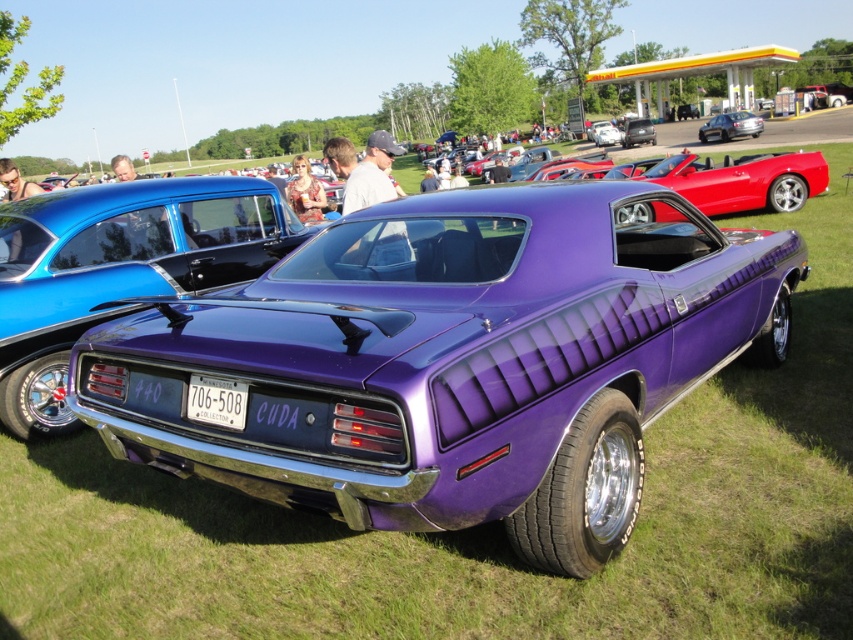
Question: Is metallic purple muscle car at center wider than white plastic license plate at center?

Choices:
 (A) yes
 (B) no

Answer: (A)

Question: Which object appears closest to the camera in this image?

Choices:
 (A) white plastic license plate at center
 (B) metallic silver sedan at center
 (C) metallic purple muscle car at center

Answer: (C)

Question: Where is metallic purple muscle car at center located in relation to metallic silver sedan at center in the image?

Choices:
 (A) left
 (B) right

Answer: (A)

Question: Which point is farther to the camera?

Choices:
 (A) metallic silver sedan at center
 (B) metallic blue sedan at center
 (C) metallic purple muscle car at center
 (D) white plastic license plate at center

Answer: (A)

Question: Does metallic purple muscle car at center lie behind metallic blue sedan at center?

Choices:
 (A) no
 (B) yes

Answer: (A)

Question: Which of the following is the farthest from the observer?

Choices:
 (A) metallic purple muscle car at center
 (B) white plastic license plate at center
 (C) metallic blue sedan at center
 (D) metallic silver sedan at center

Answer: (D)